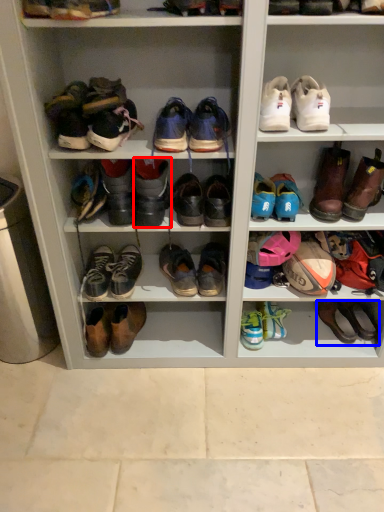
Question: Which object appears farthest to the camera in this image, footwear (highlighted by a red box) or footwear (highlighted by a blue box)?

Choices:
 (A) footwear
 (B) footwear

Answer: (B)